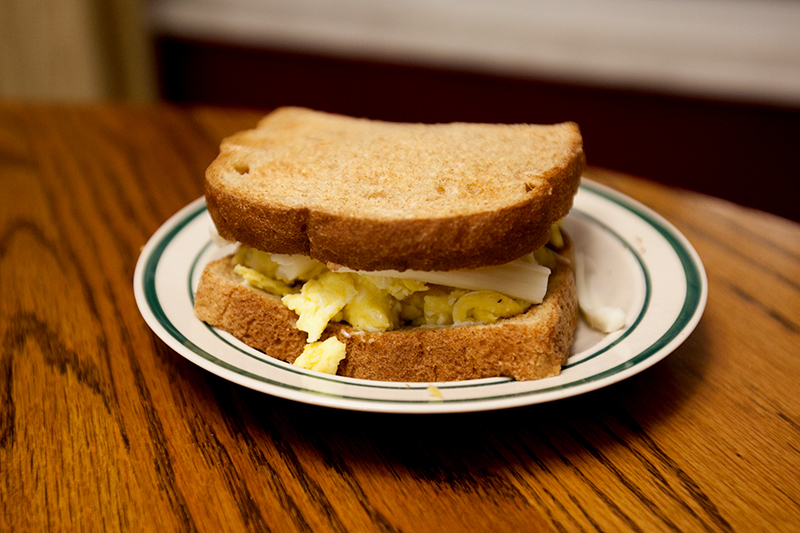
I want to click on table, so click(x=630, y=464).